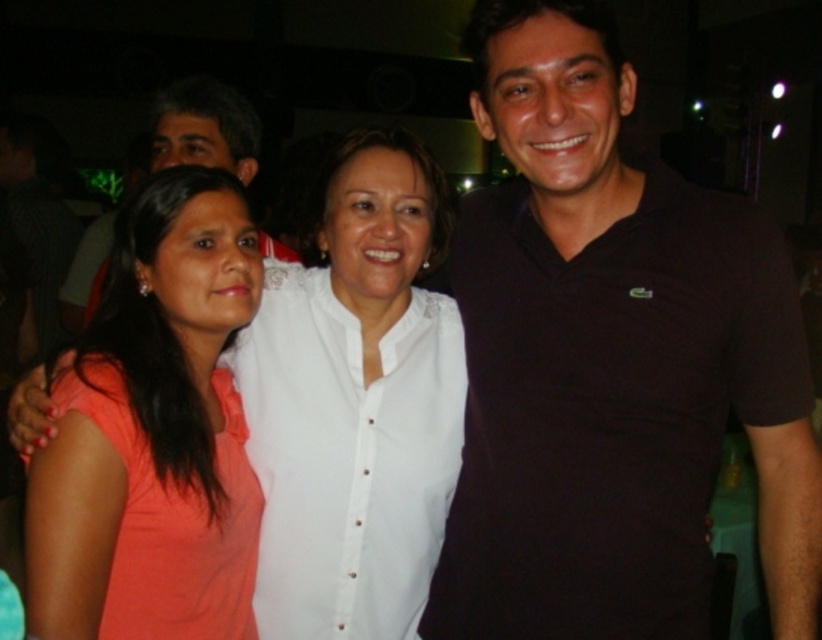
Question: Which object is positioned closest to the matte black polo shirt at center?

Choices:
 (A) black cotton polo shirt at right
 (B) matte orange shirt at center
 (C) white button-up shirt at center

Answer: (B)

Question: Observing the image, what is the correct spatial positioning of black cotton polo shirt at right in reference to white button-up shirt at center?

Choices:
 (A) above
 (B) below

Answer: (A)

Question: Can you confirm if white button-up shirt at center is smaller than matte black polo shirt at center?

Choices:
 (A) yes
 (B) no

Answer: (A)

Question: Does matte orange shirt at center have a smaller size compared to matte black polo shirt at center?

Choices:
 (A) no
 (B) yes

Answer: (B)

Question: Which point is farther to the camera?

Choices:
 (A) black cotton polo shirt at right
 (B) matte orange shirt at center

Answer: (B)

Question: Which of the following is the closest to the observer?

Choices:
 (A) white button-up shirt at center
 (B) matte orange shirt at center
 (C) matte black polo shirt at center
 (D) black cotton polo shirt at right

Answer: (D)